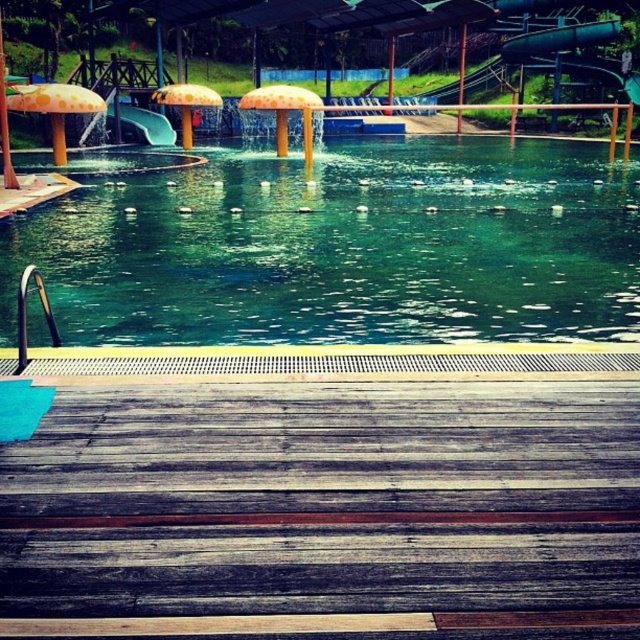
You are standing at the wooden deck and want to walk towards the pool. There are two points marked on the path. Which point is closer to you, point (61, 161) or point (172, 99)?

Point (61, 161) is in front of point (172, 99), so it is closer to you.

You are standing on the wooden deck and want to jump into the pool. Which object, the green glossy water at center or the green rubber slide at upper left, is closer to you?

The green glossy water at center is closer to the viewer than the green rubber slide at upper left, so you should aim for the green glossy water at center when jumping into the pool.